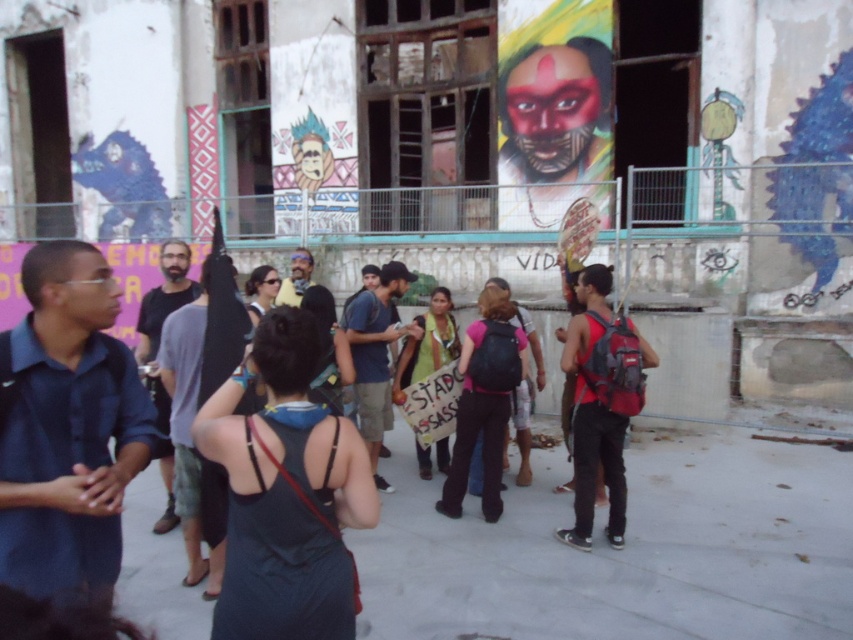
Question: Does black fabric dress at center appear on the right side of matte red face paint at upper center?

Choices:
 (A) no
 (B) yes

Answer: (A)

Question: Among these objects, which one is farthest from the camera?

Choices:
 (A) matte red face paint at upper center
 (B) dark blue shirt at center
 (C) pink fabric backpack at center

Answer: (A)

Question: Which of the following is the farthest from the observer?

Choices:
 (A) (589, 324)
 (B) (434, 336)

Answer: (B)

Question: Which point is closer to the camera?

Choices:
 (A) matte red face paint at upper center
 (B) matte black sign at center

Answer: (B)

Question: Can you confirm if dark blue shirt at center is thinner than matte black sign at center?

Choices:
 (A) yes
 (B) no

Answer: (B)

Question: Considering the relative positions of dark blue shirt at left and matte red face paint at upper center in the image provided, where is dark blue shirt at left located with respect to matte red face paint at upper center?

Choices:
 (A) below
 (B) above

Answer: (A)